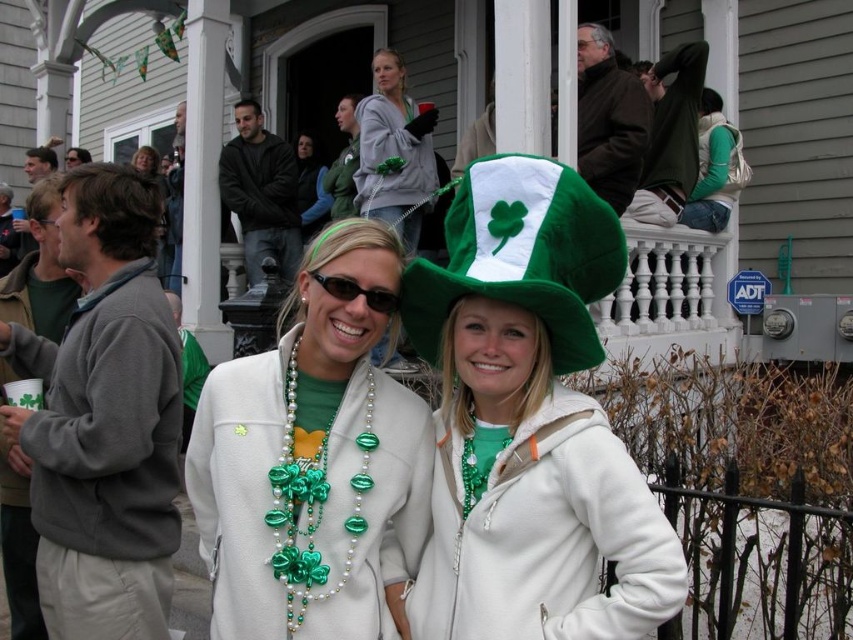
Is green felt hat at center bigger than green beaded necklace at center?

Yes.

You are a GUI agent. You are given a task and a screenshot of the screen. Output one action in this format:
    pyautogui.click(x=<x>, y=<y>)
    Task: Click on the green felt hat at center
    This screenshot has height=640, width=853.
    Given the screenshot: What is the action you would take?
    pyautogui.click(x=529, y=422)

Does matte green hat at upper center have a greater height compared to green fabric vest at upper center?

In fact, matte green hat at upper center may be shorter than green fabric vest at upper center.

Where is `matte green hat at upper center`? matte green hat at upper center is located at coordinates (393, 152).

Between green felt hat at center and green matte necklace at center, which one appears on the right side from the viewer's perspective?

green felt hat at center

Who is more distant from viewer, (448, 243) or (401, 438)?

The point (401, 438) is behind.

What do you see at coordinates (529, 422) in the screenshot?
I see `green felt hat at center` at bounding box center [529, 422].

In order to click on green felt hat at center in this screenshot , I will do `click(529, 422)`.